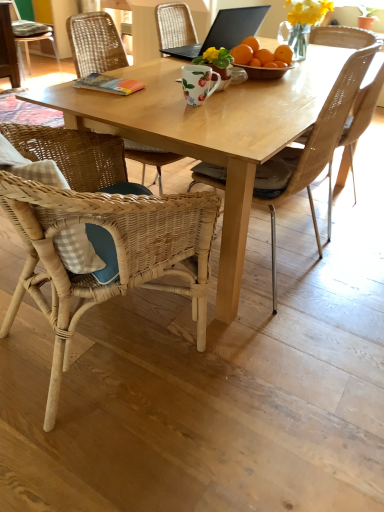
Question: Does woven wood chair at upper left, placed as the first chair when sorted from left to right, have a greater width compared to black matte laptop at upper center?

Choices:
 (A) no
 (B) yes

Answer: (B)

Question: Can you confirm if woven wood chair at upper left, placed as the first chair when sorted from left to right, is smaller than black matte laptop at upper center?

Choices:
 (A) no
 (B) yes

Answer: (A)

Question: Is woven wood chair at upper left, the fourth chair positioned from the right, to the left of black matte laptop at upper center from the viewer's perspective?

Choices:
 (A) no
 (B) yes

Answer: (B)

Question: From the image's perspective, is woven wood chair at upper left, the fourth chair positioned from the right, below black matte laptop at upper center?

Choices:
 (A) yes
 (B) no

Answer: (B)

Question: Would you say black matte laptop at upper center is part of woven wood chair at upper left, which is the fourth chair from front to back,'s contents?

Choices:
 (A) yes
 (B) no

Answer: (B)

Question: Do you think woven wicker chair at lower left, the 2th chair when ordered from left to right, is within woven wood chair at center, the 2th chair in the front-to-back sequence, or outside of it?

Choices:
 (A) inside
 (B) outside

Answer: (B)

Question: From a real-world perspective, is woven wicker chair at lower left, which ranks as the 1th chair in front-to-back order, physically located above or below woven wood chair at center, which appears as the 3th chair when viewed from the back?

Choices:
 (A) above
 (B) below

Answer: (B)

Question: Is point (24, 240) positioned closer to the camera than point (316, 176)?

Choices:
 (A) closer
 (B) farther

Answer: (A)

Question: In terms of width, does woven wicker chair at lower left, which ranks as the 1th chair in front-to-back order, look wider or thinner when compared to woven wood chair at center, acting as the 2th chair starting from the right?

Choices:
 (A) thin
 (B) wide

Answer: (B)

Question: From their relative heights in the image, would you say woven wicker chair at right, which ranks as the 1th chair in right-to-left order, is taller or shorter than floral matte coffee cup at center?

Choices:
 (A) tall
 (B) short

Answer: (A)

Question: Is woven wicker chair at right, the second chair viewed from the back, wider or thinner than floral matte coffee cup at center?

Choices:
 (A) wide
 (B) thin

Answer: (A)

Question: Relative to floral matte coffee cup at center, is woven wicker chair at right, the second chair viewed from the back, in front or behind?

Choices:
 (A) front
 (B) behind

Answer: (B)

Question: From a real-world perspective, relative to floral matte coffee cup at center, is woven wicker chair at right, marked as the 4th chair in a left-to-right arrangement, vertically above or below?

Choices:
 (A) below
 (B) above

Answer: (A)

Question: Based on their sizes in the image, would you say woven wicker chair at lower left, the 2th chair when ordered from left to right, is bigger or smaller than woven wicker chair at right, the second chair viewed from the back?

Choices:
 (A) small
 (B) big

Answer: (B)

Question: Visually, is woven wicker chair at lower left, the 4th chair when ordered from back to front, positioned to the left or to the right of woven wicker chair at right, which ranks as the 1th chair in right-to-left order?

Choices:
 (A) right
 (B) left

Answer: (B)